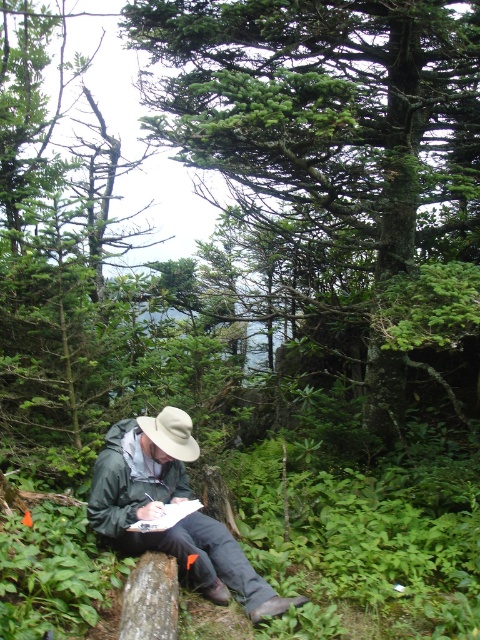
Question: Which point is closer to the camera?

Choices:
 (A) green leafy tree at center
 (B) green matte jacket at center

Answer: (B)

Question: Can you confirm if green leafy tree at center is bigger than green matte jacket at center?

Choices:
 (A) yes
 (B) no

Answer: (A)

Question: Which of the following is the closest to the observer?

Choices:
 (A) (144, 426)
 (B) (180, 422)

Answer: (B)

Question: Is green leafy tree at center bigger than white felt fedora at center?

Choices:
 (A) yes
 (B) no

Answer: (A)

Question: Which object is the farthest from the green leafy tree at center?

Choices:
 (A) white felt fedora at center
 (B) green matte jacket at center

Answer: (B)

Question: Does green leafy tree at center appear on the left side of white felt fedora at center?

Choices:
 (A) no
 (B) yes

Answer: (A)